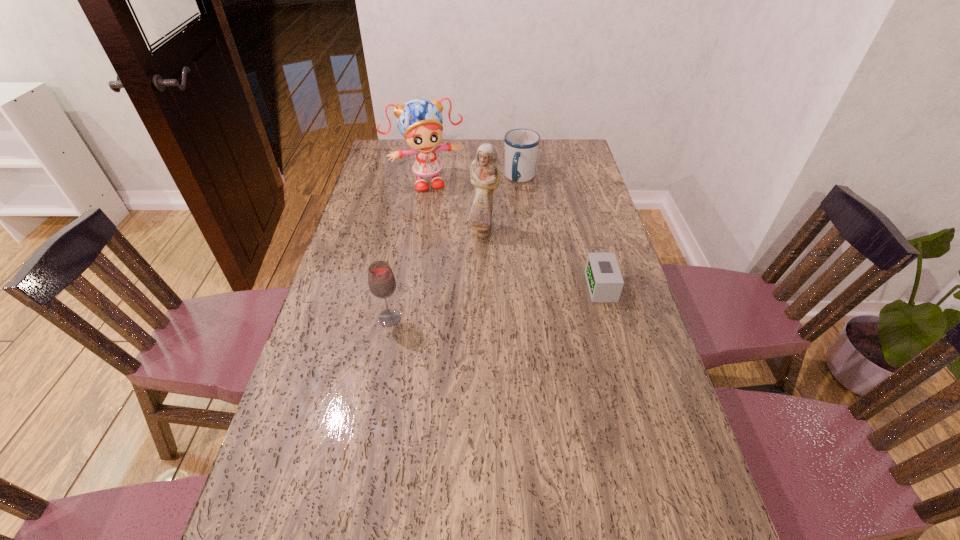
Find the location of `free spot on the desktop that is between the nearest object and the alarm clock and is positioned on the face of the doll`. free spot on the desktop that is between the nearest object and the alarm clock and is positioned on the face of the doll is located at coordinates (474, 306).

The image size is (960, 540). I want to click on free space on the desktop that is between the nearest object and the rightmost object and is positioned on the handle side of the mug, so click(x=489, y=303).

Where is `free space on the desktop that is between the glass drink container and the alarm clock and is positioned on the front-facing side of the figurine`? free space on the desktop that is between the glass drink container and the alarm clock and is positioned on the front-facing side of the figurine is located at coordinates (516, 300).